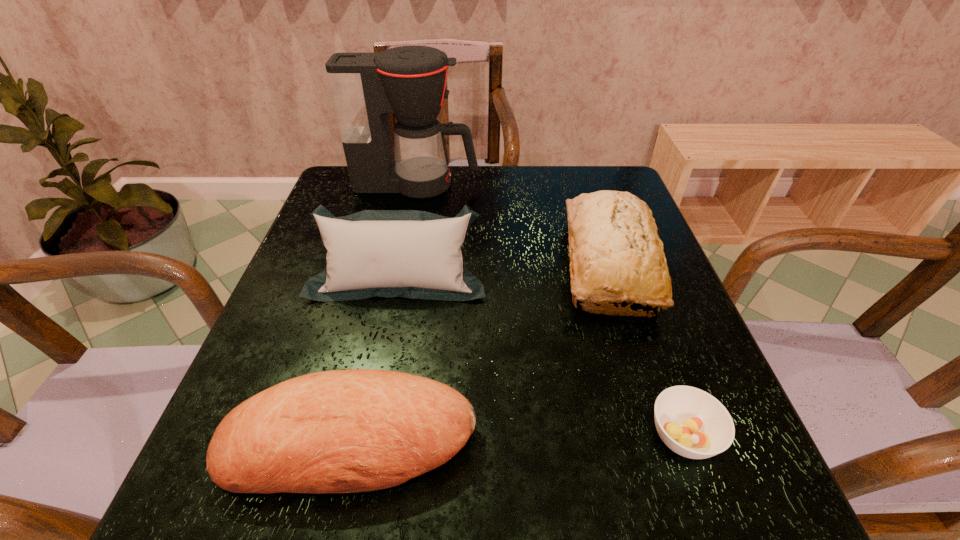
Locate an element on the screen. vacant region located 0.220m on the back of the farther bread is located at coordinates (579, 172).

Identify the location of free region located 0.160m on the back of the shorter bread. This screenshot has height=540, width=960. (377, 318).

Image resolution: width=960 pixels, height=540 pixels. Identify the location of free space located on the back of the soup bowl. (639, 314).

You are a GUI agent. You are given a task and a screenshot of the screen. Output one action in this format:
    pyautogui.click(x=<x>, y=<y>)
    Task: Click on the object positioned at the far edge
    The image size is (960, 540).
    Given the screenshot: What is the action you would take?
    pyautogui.click(x=409, y=82)

The image size is (960, 540). I want to click on bread situated at the near edge, so click(343, 431).

Identify the location of soup bowl positioned at the near edge. This screenshot has width=960, height=540. (691, 422).

Where is `coffee maker at the left edge`? coffee maker at the left edge is located at coordinates (409, 82).

This screenshot has height=540, width=960. What are the coordinates of `cushion present at the left edge` in the screenshot? It's located at (414, 254).

The height and width of the screenshot is (540, 960). Find the location of `bread that is positioned at the left edge`. bread that is positioned at the left edge is located at coordinates (343, 431).

You are a GUI agent. You are given a task and a screenshot of the screen. Output one action in this format:
    pyautogui.click(x=<x>, y=<y>)
    Task: Click on the bread that is at the right edge
    The height and width of the screenshot is (540, 960).
    Given the screenshot: What is the action you would take?
    pyautogui.click(x=613, y=242)